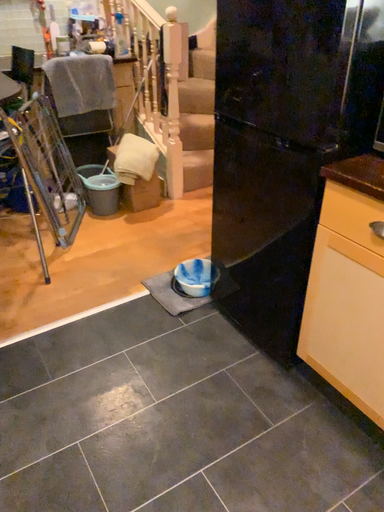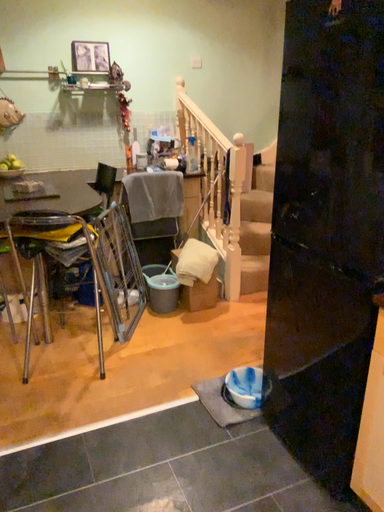
Question: Which way did the camera rotate in the video?

Choices:
 (A) rotated left
 (B) rotated right

Answer: (A)